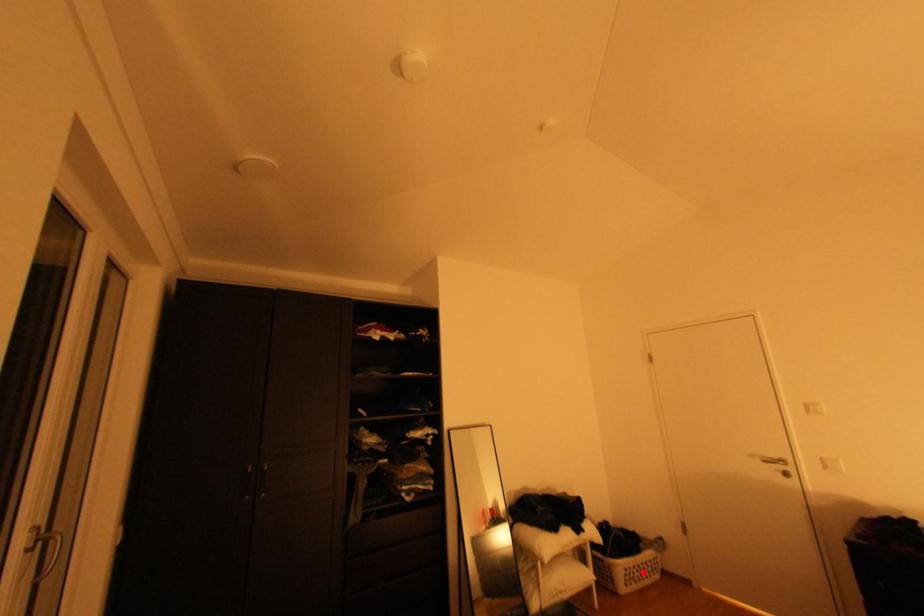
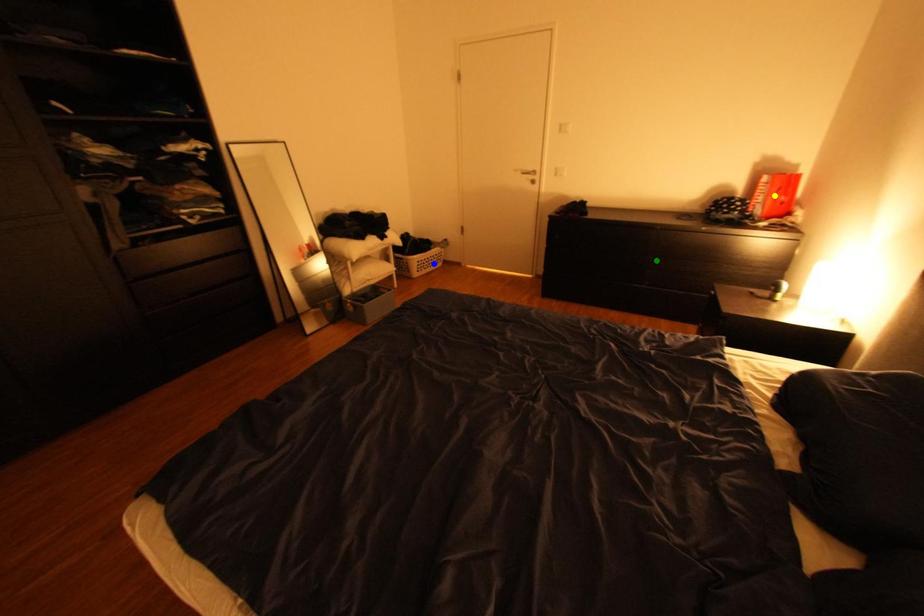
Question: I am providing you with two images of the same scene from different viewpoints. A red point is marked on the first image. You are given multiple points on the second image. Can you choose the point in image 2 that corresponds to the point in image 1?

Choices:
 (A) yellow point
 (B) blue point
 (C) green point

Answer: (B)